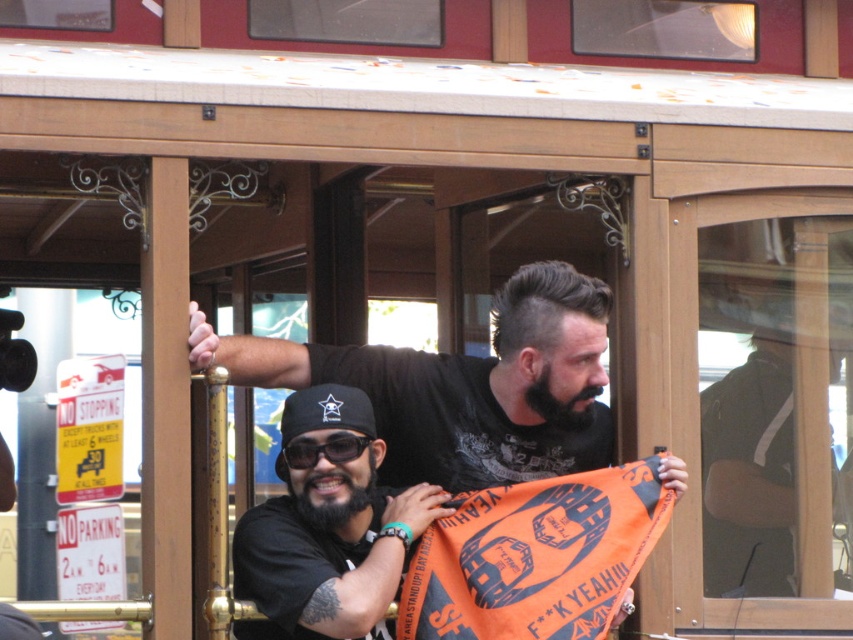
Question: Estimate the real-world distances between objects in this image. Which object is closer to the black matte shirt at center?

Choices:
 (A) orange fabric flag at center
 (B) black matte sunglasses at center

Answer: (A)

Question: Which of the following is the closest to the observer?

Choices:
 (A) gold polished metal pole at center
 (B) black matte sunglasses at center
 (C) black matte shirt at center
 (D) orange fabric flag at center

Answer: (D)

Question: Which of the following is the farthest from the observer?

Choices:
 (A) gold polished metal pole at center
 (B) black matte shirt at center
 (C) black matte sunglasses at center

Answer: (C)

Question: Is black matte shirt at center closer to camera compared to gold polished metal pole at center?

Choices:
 (A) yes
 (B) no

Answer: (B)

Question: Observing the image, what is the correct spatial positioning of gold polished metal pole at center in reference to black matte sunglasses at center?

Choices:
 (A) below
 (B) above

Answer: (A)

Question: Is black matte shirt at center thinner than black matte sunglasses at center?

Choices:
 (A) yes
 (B) no

Answer: (B)